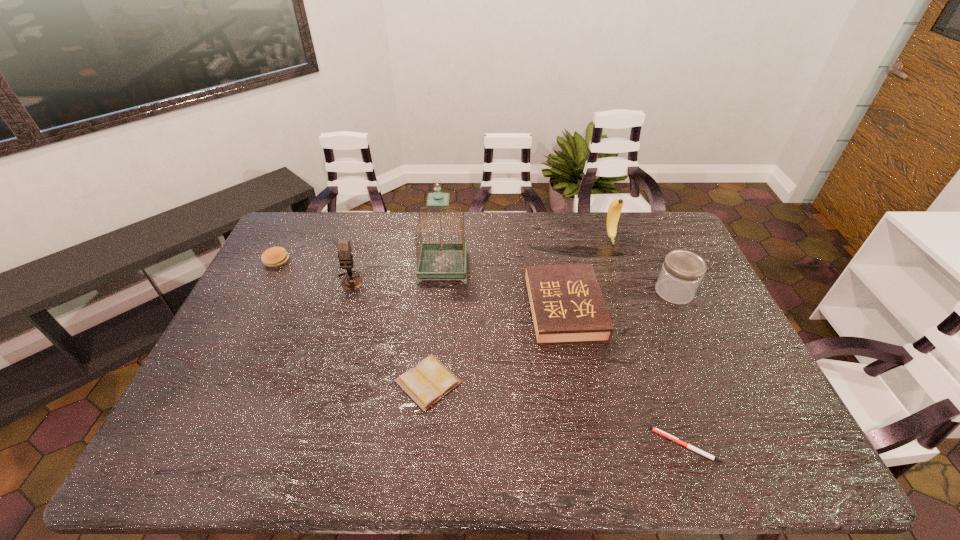
Where is `object that ranks as the fifth closest to the pen`? Image resolution: width=960 pixels, height=540 pixels. object that ranks as the fifth closest to the pen is located at coordinates (614, 210).

Image resolution: width=960 pixels, height=540 pixels. I want to click on vacant area in the image that satisfies the following two spatial constraints: 1. from the stem of the banana; 2. on the right side of the rightmost object, so click(630, 292).

Where is `blank space that satisfies the following two spatial constraints: 1. on the front-facing side of the second object from left to right; 2. on the right side of the fourth shortest object`? blank space that satisfies the following two spatial constraints: 1. on the front-facing side of the second object from left to right; 2. on the right side of the fourth shortest object is located at coordinates (342, 309).

Where is `free space that satisfies the following two spatial constraints: 1. on the front-facing side of the seventh object from right to left; 2. on the left side of the rightmost object`? free space that satisfies the following two spatial constraints: 1. on the front-facing side of the seventh object from right to left; 2. on the left side of the rightmost object is located at coordinates (347, 292).

This screenshot has height=540, width=960. I want to click on free region that satisfies the following two spatial constraints: 1. on the front-facing side of the second shortest object; 2. on the right side of the second object from left to right, so click(x=319, y=382).

The image size is (960, 540). Identify the location of free space that satisfies the following two spatial constraints: 1. at the door of the birdcage; 2. on the right side of the fifth tallest object. (440, 309).

Locate an element on the screen. Image resolution: width=960 pixels, height=540 pixels. free spot that satisfies the following two spatial constraints: 1. on the back side of the hardback book; 2. on the left side of the fourth tallest object is located at coordinates (562, 292).

Identify the location of free location that satisfies the following two spatial constraints: 1. on the front-facing side of the diary; 2. on the left side of the seventh object from right to left. [x=319, y=382].